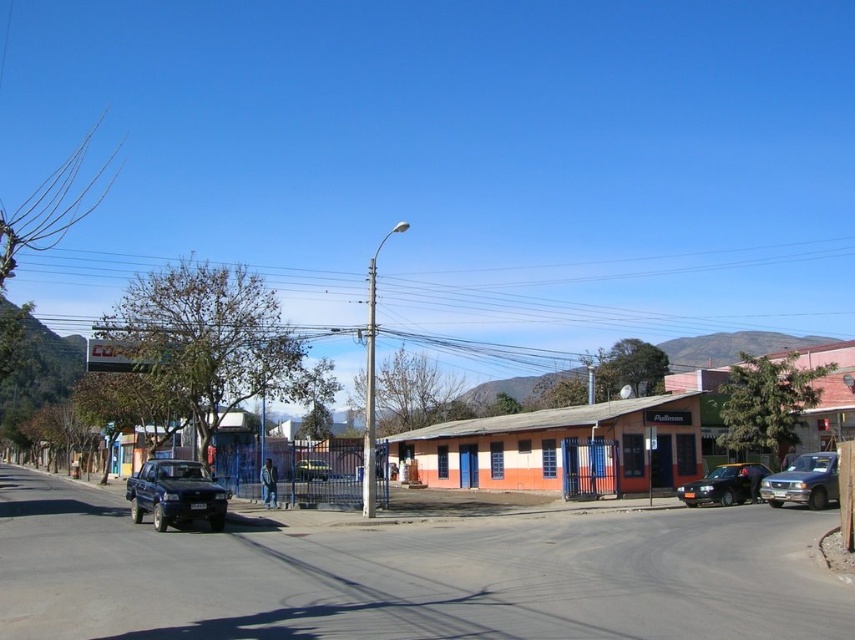
You are a pedestrian standing on the sidewalk and want to cross the street to reach the building with the word Pullman. The metallic blue truck at right and the shiny black sedan at center are parked on the road. Which vehicle should you walk around to get to the Pullman building?

You should walk around the metallic blue truck at right because it is closer to you, making it easier to navigate around before reaching the shiny black sedan at center which is further away.

You are a delivery driver who needs to park your van between the shiny black sedan at center and the metallic blue truck at center. The van is 20 feet long. Is there enough space between them to park your van?

The shiny black sedan at center and metallic blue truck at center are 53.77 feet apart from each other. Since the van is 20 feet long, there is sufficient space between them to park the van as the distance between the two vehicles is greater than the van length.

You are a delivery person who needs to park your van between the matte black truck at lower left and the metallic blue truck at right. The van is 6 meters long. Is there enough space between them to park your van?

The matte black truck at lower left and metallic blue truck at right are 19.87 meters apart. Since the van is only 6 meters long, there is more than enough space between them to park the van.